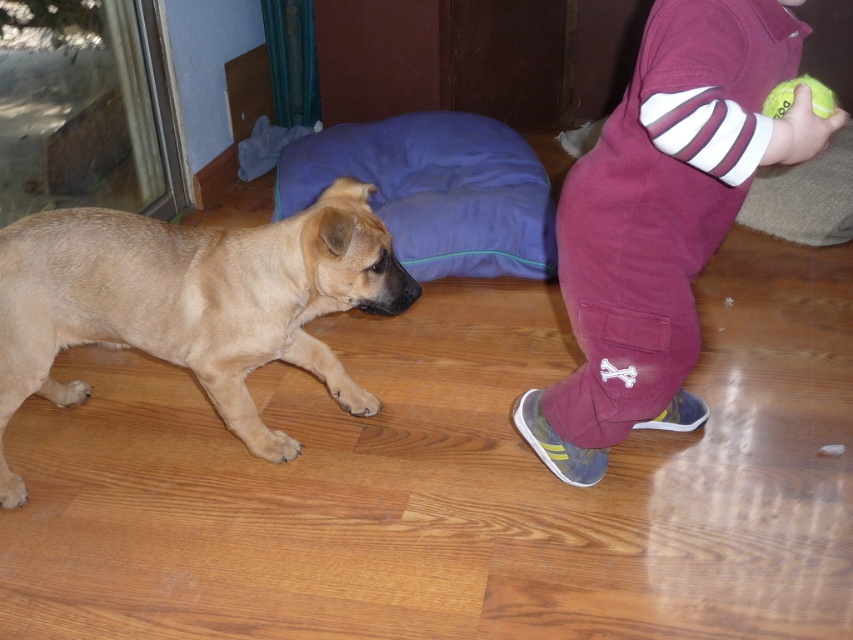
Question: Is maroon cotton pants at right to the left of light brown fur at left from the viewer's perspective?

Choices:
 (A) yes
 (B) no

Answer: (B)

Question: Which point is closer to the camera?

Choices:
 (A) purple fabric pillow at center
 (B) maroon cotton pants at right
 (C) light brown fur at left
 (D) yellow rubber tennis ball at lower right

Answer: (B)

Question: Is light brown fur at left to the right of purple fabric pillow at center from the viewer's perspective?

Choices:
 (A) no
 (B) yes

Answer: (A)

Question: Estimate the real-world distances between objects in this image. Which object is closer to the light brown fur at left?

Choices:
 (A) maroon cotton pants at right
 (B) yellow rubber tennis ball at lower right

Answer: (A)

Question: Does maroon cotton pants at right have a lesser width compared to yellow rubber tennis ball at lower right?

Choices:
 (A) yes
 (B) no

Answer: (B)

Question: Which object is the farthest from the light brown fur at left?

Choices:
 (A) yellow rubber tennis ball at lower right
 (B) purple fabric pillow at center

Answer: (A)